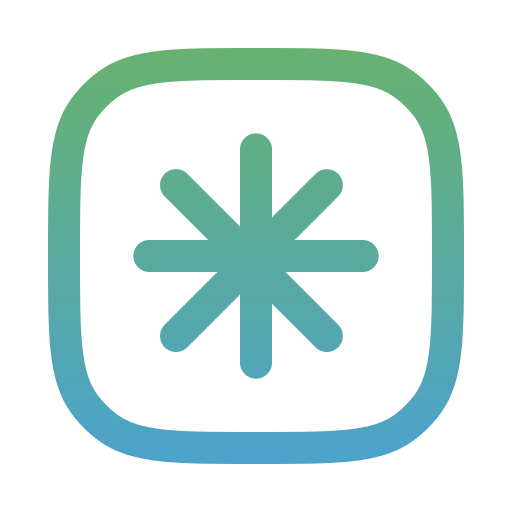
Locate an element on the screen. rounded corners is located at coordinates (104, 81), (133, 437), (407, 424).